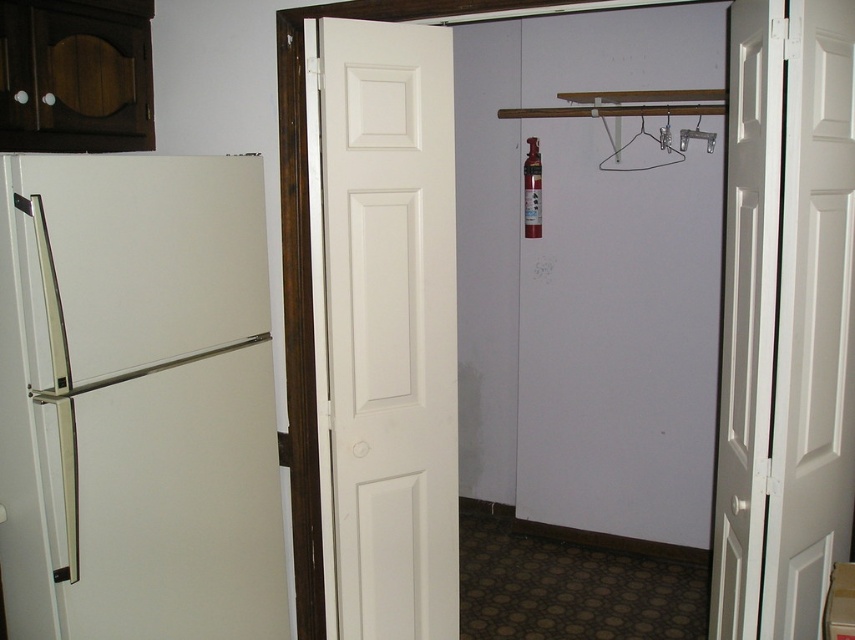
Between point (83, 376) and point (783, 236), which one is positioned behind?

Point (83, 376)

Which is in front, point (46, 228) or point (844, 44)?

Point (46, 228) is more forward.

Between point (252, 216) and point (815, 216), which one is positioned in front?

Positioned in front is point (815, 216).

Find the location of a particular element. white matte refrigerator at left is located at coordinates (140, 401).

Is white smooth door at center bigger than metallic silver hanger at upper center?

Yes, white smooth door at center is bigger than metallic silver hanger at upper center.

Is point (824, 452) in front of point (616, 170)?

Yes, it is.

You are a GUI agent. You are given a task and a screenshot of the screen. Output one action in this format:
    pyautogui.click(x=<x>, y=<y>)
    Task: Click on the white smooth door at center
    The image size is (855, 640).
    Given the screenshot: What is the action you would take?
    pyautogui.click(x=812, y=324)

Does white matte door at center have a lesser height compared to white smooth door at center?

No, white matte door at center is not shorter than white smooth door at center.

Locate an element on the screen. white matte door at center is located at coordinates (388, 330).

Who is more distant from viewer, (435, 124) or (811, 413)?

The point (435, 124) is behind.

Find the location of `white matte door at center`. white matte door at center is located at coordinates (388, 330).